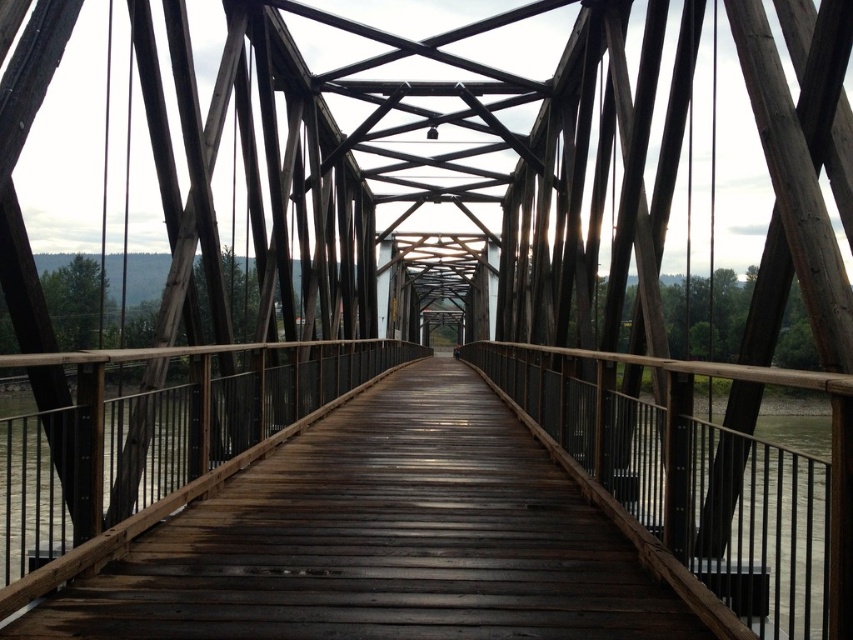
Question: Can you confirm if brown wooden bridge at center is positioned to the left of brown/wooden river at lower right?

Choices:
 (A) yes
 (B) no

Answer: (A)

Question: Does brown wooden bridge at center have a greater width compared to brown/wooden river at lower right?

Choices:
 (A) no
 (B) yes

Answer: (A)

Question: Does brown wooden bridge at center lie in front of brown/wooden river at lower right?

Choices:
 (A) no
 (B) yes

Answer: (A)